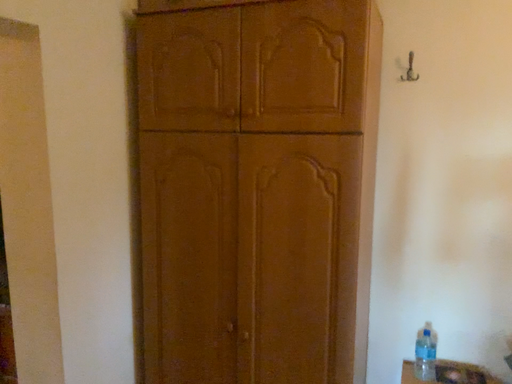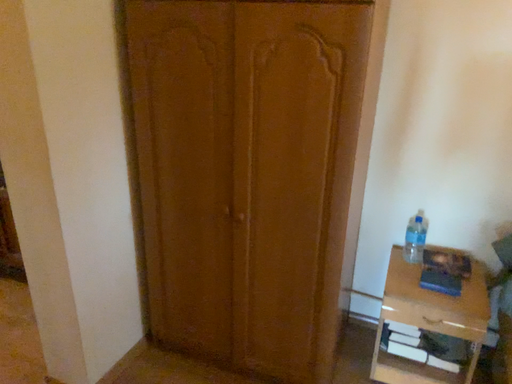
Question: Which way did the camera rotate in the video?

Choices:
 (A) rotated upward
 (B) rotated downward

Answer: (B)